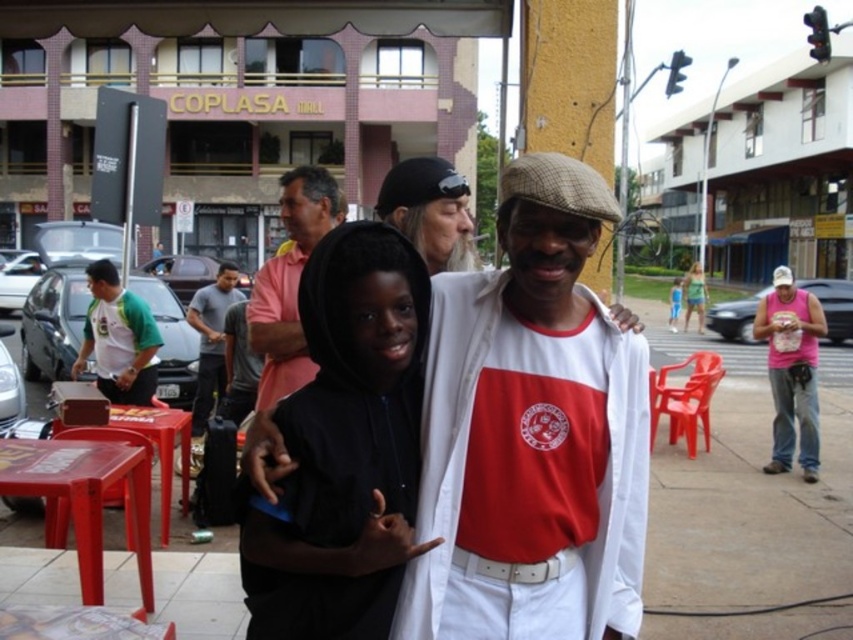
You are a photographer standing on the white concrete pavement at center. You want to take a photo of the pink sleeveless shirt at right. Which direction should you look to capture it in your frame?

The white concrete pavement at center is located below the pink sleeveless shirt at right, so you should look upward to capture it in your frame.

You are a photographer standing 1.5 meters away from the pink cotton shirt at center. You want to take a photo of the shirt and also include the camera in the frame. Do you need to move closer or farther away?

The pink cotton shirt at center and camera are 2.53 meters apart. Since you are already 1.5 meters away from the pink cotton shirt at center, you need to move farther away to include both in the frame.